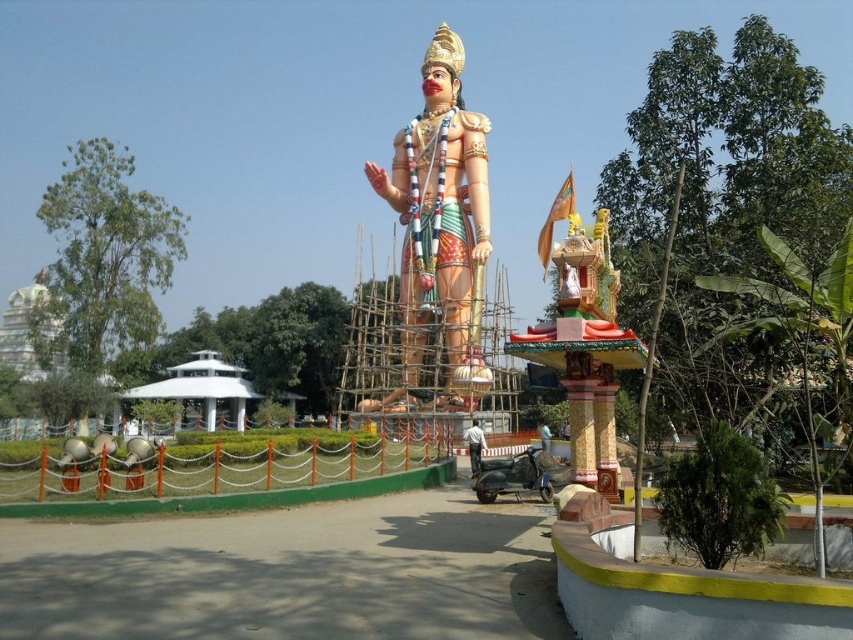
Question: Does matte plastic statue at center appear over metallic helmet at center?

Choices:
 (A) yes
 (B) no

Answer: (A)

Question: Which point appears farthest from the camera in this image?

Choices:
 (A) (415, 300)
 (B) (476, 452)

Answer: (A)

Question: Does matte plastic statue at center appear on the left side of metallic helmet at center?

Choices:
 (A) yes
 (B) no

Answer: (A)

Question: Can you confirm if matte plastic statue at center is positioned above metallic helmet at center?

Choices:
 (A) no
 (B) yes

Answer: (B)

Question: Which point is closer to the camera?

Choices:
 (A) matte plastic statue at center
 (B) metallic helmet at center

Answer: (B)